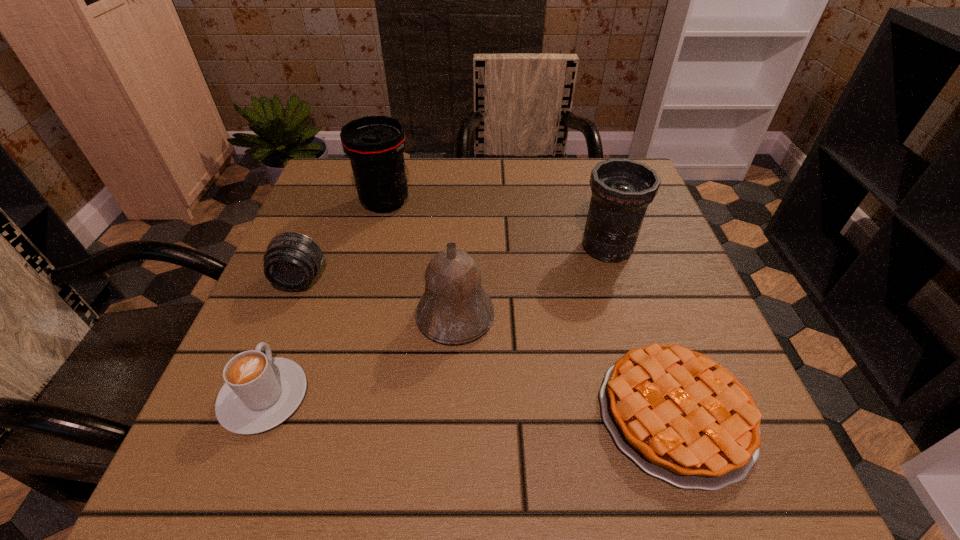
I want to click on free space between the farthest telephoto lens and the second shortest object, so click(324, 300).

The height and width of the screenshot is (540, 960). In order to click on free spot between the fourth object from left to right and the farthest telephoto lens in this screenshot , I will do `click(420, 259)`.

Select which object is the fifth closest to the fourth object from left to right. Please provide its 2D coordinates. Your answer should be formatted as a tuple, i.e. [(x, y)], where the tuple contains the x and y coordinates of a point satisfying the conditions above.

[(375, 144)]

This screenshot has height=540, width=960. I want to click on the fourth closest object relative to the farthest object, so click(260, 392).

The height and width of the screenshot is (540, 960). Identify the location of telephoto lens identified as the second closest to the second telephoto lens from left to right. (622, 189).

Identify which telephoto lens is the second closest to the leftmost telephoto lens. Please provide its 2D coordinates. Your answer should be formatted as a tuple, i.e. [(x, y)], where the tuple contains the x and y coordinates of a point satisfying the conditions above.

[(622, 189)]

At what (x,y) coordinates should I click in order to perform the action: click on free space in the image that satisfies the following two spatial constraints: 1. at the front element of the third object from right to left; 2. on the right side of the leftmost telephoto lens. Please return your answer as a coordinate pair (x, y). Image resolution: width=960 pixels, height=540 pixels. Looking at the image, I should click on (285, 316).

You are a GUI agent. You are given a task and a screenshot of the screen. Output one action in this format:
    pyautogui.click(x=<x>, y=<y>)
    Task: Click on the free region that satisfies the following two spatial constraints: 1. to the right of the farthest object; 2. on the left side of the cappuccino
    Image resolution: width=960 pixels, height=540 pixels.
    Given the screenshot: What is the action you would take?
    pyautogui.click(x=339, y=202)

Where is `vacant point that satisfies the following two spatial constraints: 1. to the right of the fourth object from left to right; 2. on the left side of the fifth tallest object`? The height and width of the screenshot is (540, 960). vacant point that satisfies the following two spatial constraints: 1. to the right of the fourth object from left to right; 2. on the left side of the fifth tallest object is located at coordinates (296, 316).